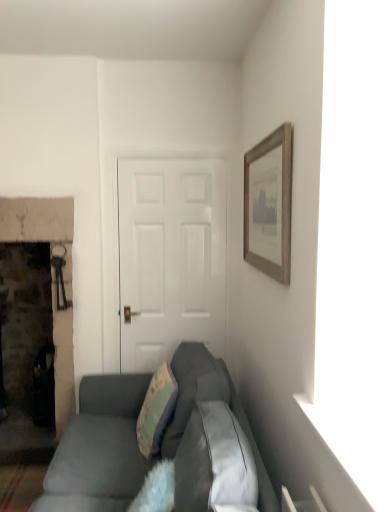
Question: In the image, is teal fabric pillow at center positioned in front of or behind black plastic trash can at left?

Choices:
 (A) front
 (B) behind

Answer: (A)

Question: Considering the relative positions of teal fabric pillow at center and black plastic trash can at left in the image provided, is teal fabric pillow at center to the left or to the right of black plastic trash can at left?

Choices:
 (A) left
 (B) right

Answer: (B)

Question: Estimate the real-world distances between objects in this image. Which object is closer to the teal fabric pillow at center?

Choices:
 (A) black plastic trash can at left
 (B) suede gray couch at lower center
 (C) wooden framed print at upper right

Answer: (B)

Question: Based on their relative distances, which object is farther from the black plastic trash can at left?

Choices:
 (A) wooden framed print at upper right
 (B) teal fabric pillow at center
 (C) suede gray couch at lower center

Answer: (A)